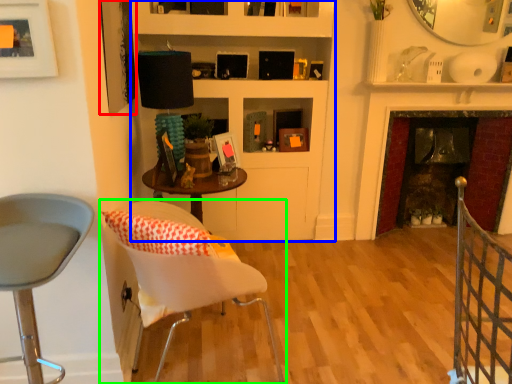
Question: Based on their relative distances, which object is farther from picture frame (highlighted by a red box)? Choose from bookshelf (highlighted by a blue box) and chair (highlighted by a green box).

Choices:
 (A) bookshelf
 (B) chair

Answer: (A)